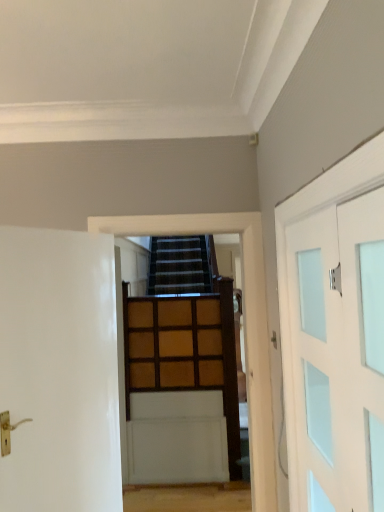
Question: Is wooden paneling at center spatially inside white glossy door at left, marked as the 1th door in a left-to-right arrangement, or outside of it?

Choices:
 (A) outside
 (B) inside

Answer: (A)

Question: Considering the positions of point (233, 211) and point (21, 441), is point (233, 211) closer or farther from the camera than point (21, 441)?

Choices:
 (A) farther
 (B) closer

Answer: (A)

Question: Which object is the closest to the wooden paneling at center?

Choices:
 (A) white frosted glass door at right, the 1th door when ordered from right to left
 (B) wooden paneling at center
 (C) white glossy door at left, marked as the 1th door in a left-to-right arrangement

Answer: (C)

Question: Based on their relative distances, which object is nearer to the wooden paneling at center?

Choices:
 (A) white glossy door at left, marked as the 1th door in a left-to-right arrangement
 (B) white frosted glass door at right, the 2th door in the left-to-right sequence
 (C) wooden paneling at center

Answer: (C)